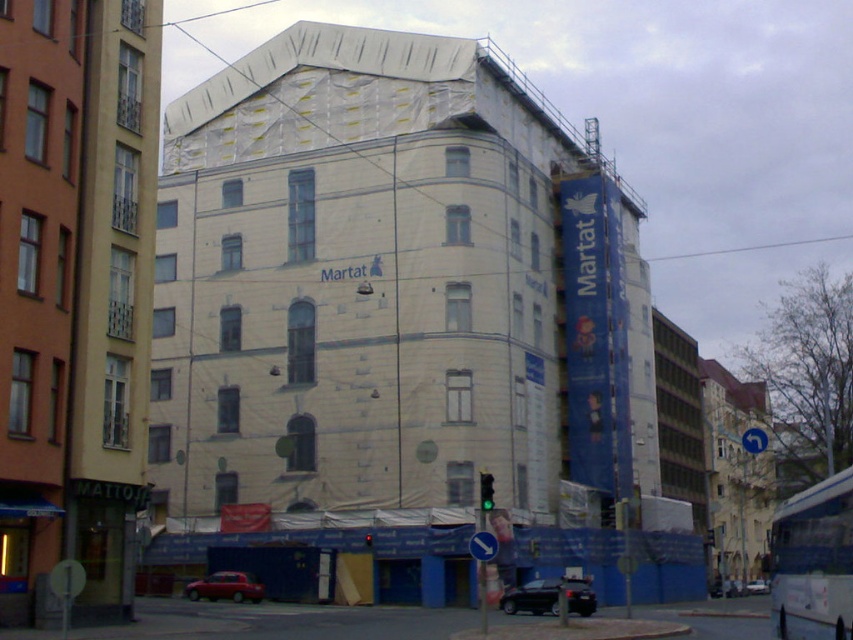
Question: Which point is closer to the camera?

Choices:
 (A) (721, 588)
 (B) (547, 595)

Answer: (B)

Question: Is metallic silver car at center wider than silver metallic sedan at center?

Choices:
 (A) no
 (B) yes

Answer: (A)

Question: Can you confirm if black glossy car at center is positioned above metallic silver car at center?

Choices:
 (A) no
 (B) yes

Answer: (B)

Question: Which of the following is the closest to the observer?

Choices:
 (A) (550, 604)
 (B) (714, 586)

Answer: (A)

Question: Which point appears closest to the camera in this image?

Choices:
 (A) (717, 589)
 (B) (212, 592)
 (C) (755, 586)
 (D) (590, 605)

Answer: (D)

Question: Is black glossy car at center closer to the viewer compared to shiny red car at lower left?

Choices:
 (A) yes
 (B) no

Answer: (A)